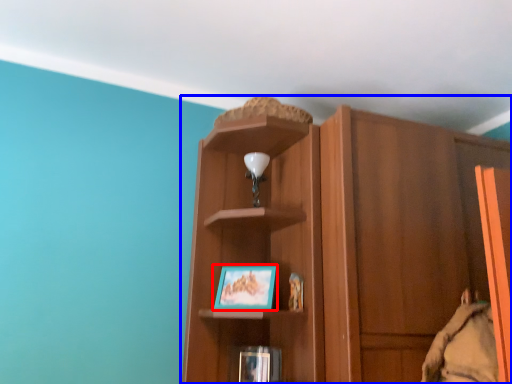
Question: Among these objects, which one is nearest to the camera, picture frame (highlighted by a red box) or cupboard (highlighted by a blue box)?

Choices:
 (A) picture frame
 (B) cupboard

Answer: (B)